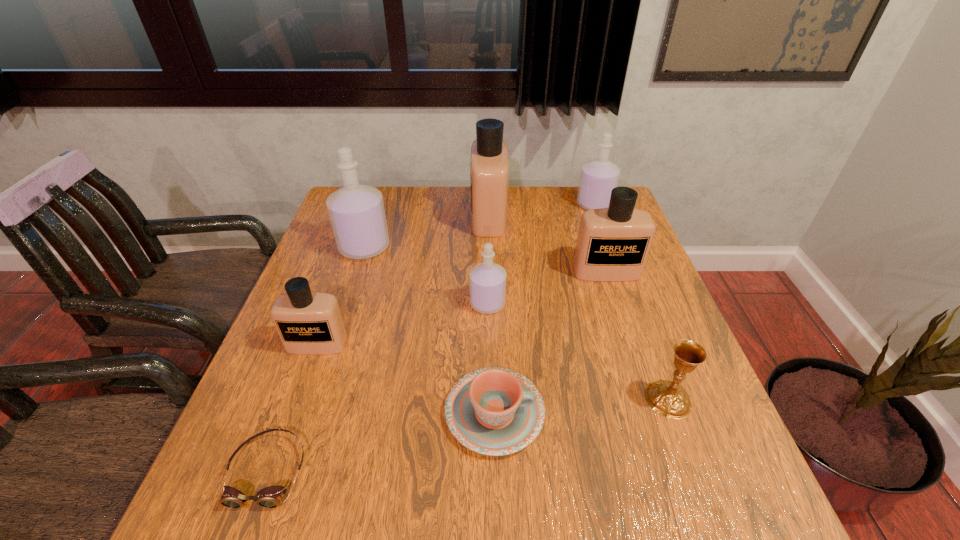
Point out which beige perfume is positioned as the nearest to the shortest object. Please provide its 2D coordinates. Your answer should be formatted as a tuple, i.e. [(x, y)], where the tuple contains the x and y coordinates of a point satisfying the conditions above.

[(309, 323)]

Where is `the second closest beige perfume to the farthest beige perfume`? the second closest beige perfume to the farthest beige perfume is located at coordinates (309, 323).

Image resolution: width=960 pixels, height=540 pixels. I want to click on purple perfume that is the closest to the second shortest object, so click(x=487, y=281).

Where is `purple perfume that is the third nearest to the seventh tallest object`? purple perfume that is the third nearest to the seventh tallest object is located at coordinates (356, 211).

Find the location of a particular element. vacant point that satisfies the following two spatial constraints: 1. on the front label of the biggest beige perfume; 2. on the front label of the nearest perfume is located at coordinates (492, 344).

Where is `vacant point that satisfies the following two spatial constraints: 1. on the front label of the gold chalice; 2. on the right side of the leftmost beige perfume`? The height and width of the screenshot is (540, 960). vacant point that satisfies the following two spatial constraints: 1. on the front label of the gold chalice; 2. on the right side of the leftmost beige perfume is located at coordinates (298, 399).

Locate an element on the screen. Image resolution: width=960 pixels, height=540 pixels. blank area in the image that satisfies the following two spatial constraints: 1. on the front label of the second beige perfume from left to right; 2. on the front label of the leftmost beige perfume is located at coordinates (492, 344).